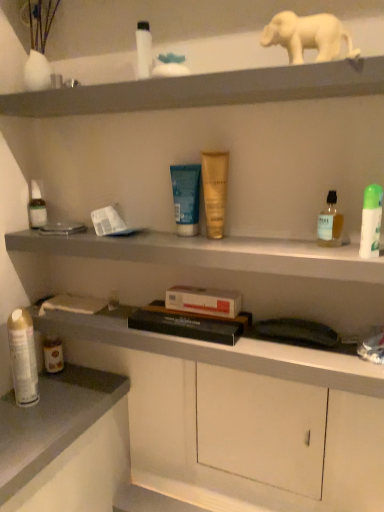
This screenshot has width=384, height=512. Find the location of `vacant space in front of gold matte tube at center, which appears as the 3th toiletry when viewed from the right`. vacant space in front of gold matte tube at center, which appears as the 3th toiletry when viewed from the right is located at coordinates (236, 248).